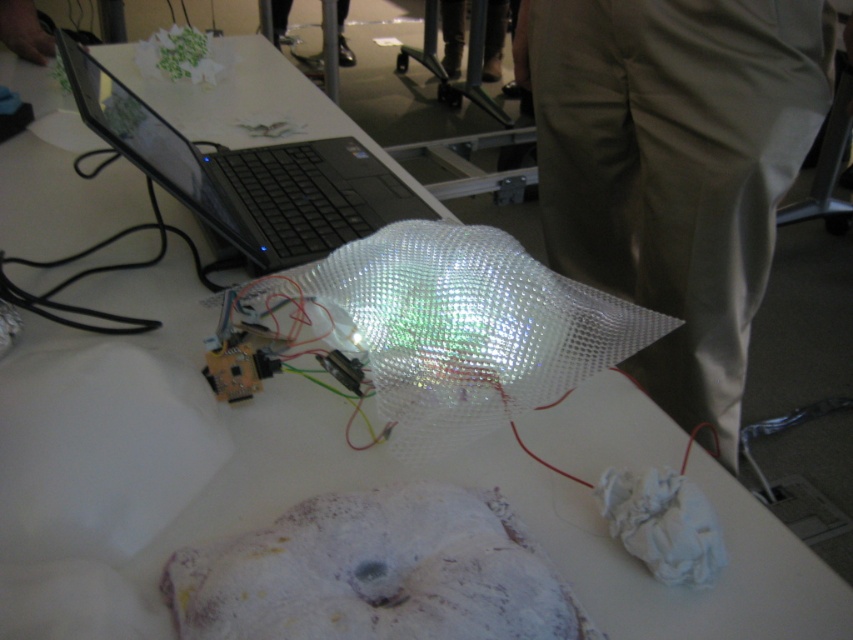
Question: Is khaki cotton pants at right to the right of black glossy laptop at upper left from the viewer's perspective?

Choices:
 (A) no
 (B) yes

Answer: (B)

Question: Which point is farther from the camera taking this photo?

Choices:
 (A) (772, 76)
 (B) (167, 170)

Answer: (A)

Question: Which of the following is the closest to the observer?

Choices:
 (A) khaki cotton pants at right
 (B) black glossy laptop at upper left

Answer: (B)

Question: Is khaki cotton pants at right thinner than black glossy laptop at upper left?

Choices:
 (A) no
 (B) yes

Answer: (B)

Question: Is khaki cotton pants at right thinner than black glossy laptop at upper left?

Choices:
 (A) yes
 (B) no

Answer: (A)

Question: Among these objects, which one is farthest from the camera?

Choices:
 (A) black glossy laptop at upper left
 (B) khaki cotton pants at right

Answer: (B)